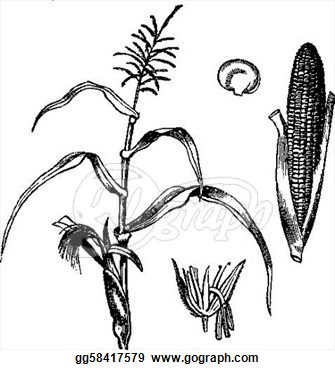
The width and height of the screenshot is (335, 370). What are the coordinates of `picture` in the screenshot? It's located at (202, 301).